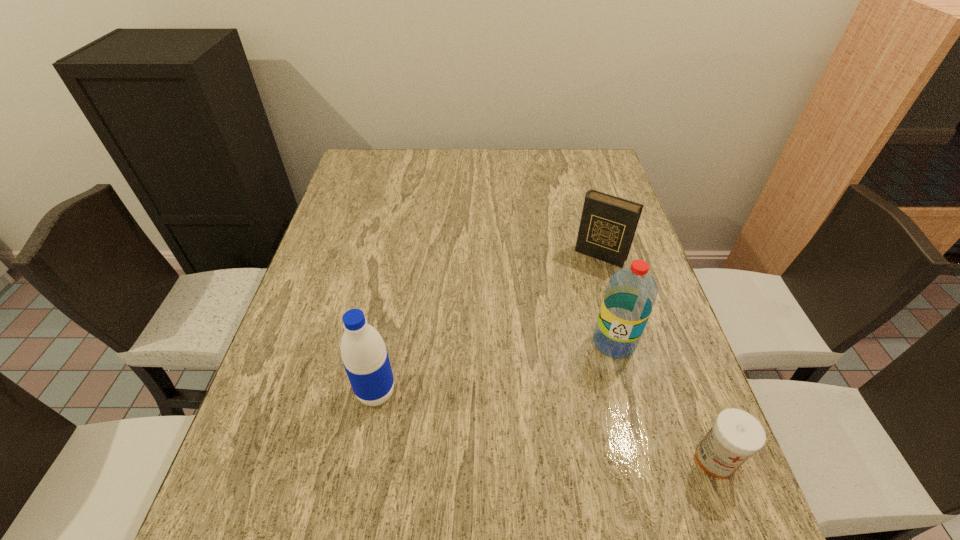
At what (x,y) coordinates should I click in order to perform the action: click on vacant space located 0.120m on the front label of the third nearest object. Please return your answer as a coordinate pair (x, y). Image resolution: width=960 pixels, height=540 pixels. Looking at the image, I should click on (586, 400).

This screenshot has height=540, width=960. Find the location of `vacant space situated on the front label of the third nearest object`. vacant space situated on the front label of the third nearest object is located at coordinates (588, 396).

Where is `free location located 0.240m on the front label of the third nearest object`? The height and width of the screenshot is (540, 960). free location located 0.240m on the front label of the third nearest object is located at coordinates (561, 449).

What are the coordinates of `free space located on the front cover of the farthest object` in the screenshot? It's located at (540, 352).

What are the coordinates of `free spot located 0.390m on the front cover of the farthest object` in the screenshot? It's located at (526, 376).

Where is `vacant space located 0.310m on the front cover of the farthest object`? The height and width of the screenshot is (540, 960). vacant space located 0.310m on the front cover of the farthest object is located at coordinates (541, 349).

You are a GUI agent. You are given a task and a screenshot of the screen. Output one action in this format:
    pyautogui.click(x=<x>, y=<y>)
    Task: Click on the object that is at the near edge
    
    Given the screenshot: What is the action you would take?
    pyautogui.click(x=736, y=435)

Locate an element on the screen. This screenshot has height=540, width=960. medicine located at the right edge is located at coordinates (736, 435).

Find the location of a particular element. The image size is (960, 540). water bottle that is at the right edge is located at coordinates (631, 292).

This screenshot has width=960, height=540. I want to click on diary situated at the right edge, so [x=608, y=223].